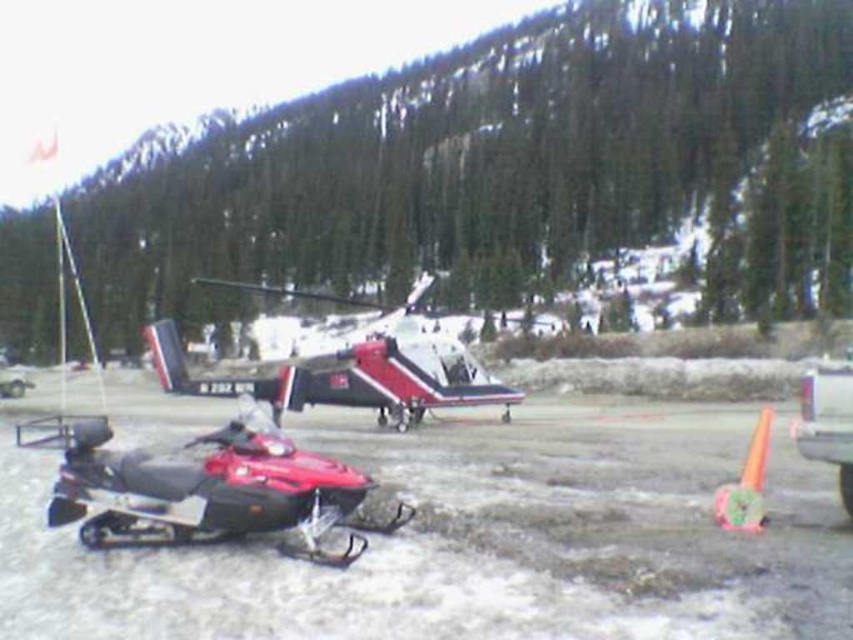
You are standing at the point with coordinates point (479, 384) and want to walk towards the point (125, 524). Which direction should you move relative to the snowmobile parked in the foreground?

You should move forward towards the point (125, 524) because it is in front of point (479, 384), meaning the direction towards it is forward from your current position at point (479, 384).

Based on the photo, you are a delivery drone operator. Your drone needs to land on the cleared area where the white matte helicopter at center and orange rubber cone at lower right are located. Based on their positions, which object will the drone encounter first upon landing?

The white matte helicopter at center is closer to the drone than the orange rubber cone at lower right, so the drone will first encounter the white matte helicopter at center upon landing.

You are a delivery drone operator. Your drone has a maximum flight range of 200 feet. You need to deliver a package from the white matte helicopter at center to the orange rubber cone at lower right. Can your drone complete this delivery without needing a recharge?

The distance between the white matte helicopter at center and the orange rubber cone at lower right is 241.43 feet, which exceeds the drone operator mentioned maximum flight range of 200 feet. Therefore, the drone cannot complete the delivery without needing a recharge.